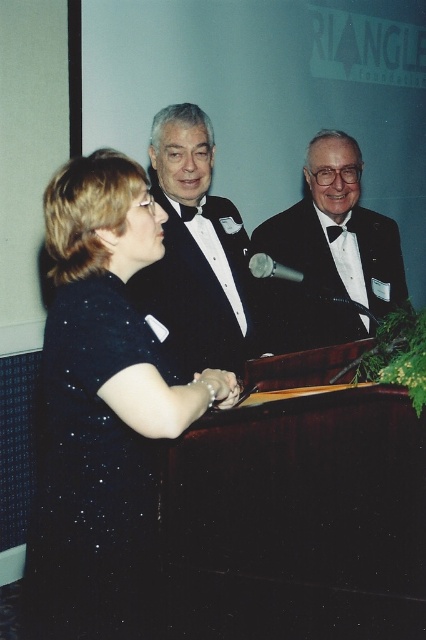
Is black sequined dress at left to the left of black satin tuxedo at center from the viewer's perspective?

Indeed, black sequined dress at left is positioned on the left side of black satin tuxedo at center.

Does black sequined dress at left have a lesser width compared to black satin tuxedo at center?

Indeed, black sequined dress at left has a lesser width compared to black satin tuxedo at center.

Who is more forward, (95, 636) or (183, 161)?

Point (95, 636) is more forward.

This screenshot has width=426, height=640. What are the coordinates of `black sequined dress at left` in the screenshot? It's located at (92, 476).

Does black satin suit at center lie behind black satin bow tie at center?

No, black satin suit at center is in front of black satin bow tie at center.

Which is above, black satin suit at center or black satin bow tie at center?

black satin bow tie at center is above.

What are the coordinates of `black satin suit at center` in the screenshot? It's located at (330, 252).

You are a GUI agent. You are given a task and a screenshot of the screen. Output one action in this format:
    pyautogui.click(x=<x>, y=<y>)
    Task: Click on the black satin suit at center
    The width and height of the screenshot is (426, 640).
    Given the screenshot: What is the action you would take?
    pyautogui.click(x=330, y=252)

Which is in front, point (77, 490) or point (307, 164)?

Point (77, 490) is in front.

Who is higher up, black sequined dress at left or black satin suit at center?

Positioned higher is black satin suit at center.

Looking at this image, who is more forward, (74, 420) or (379, 252)?

Positioned in front is point (74, 420).

At what (x,y) coordinates should I click in order to perform the action: click on black sequined dress at left. Please return your answer as a coordinate pair (x, y). The width and height of the screenshot is (426, 640). Looking at the image, I should click on (92, 476).